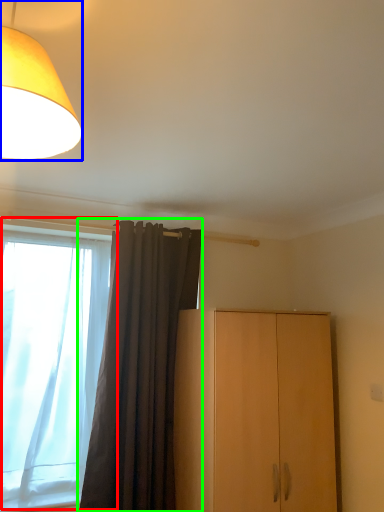
Question: Which object is positioned farthest from window (highlighted by a red box)? Select from lamp (highlighted by a blue box) and curtain (highlighted by a green box).

Choices:
 (A) lamp
 (B) curtain

Answer: (A)